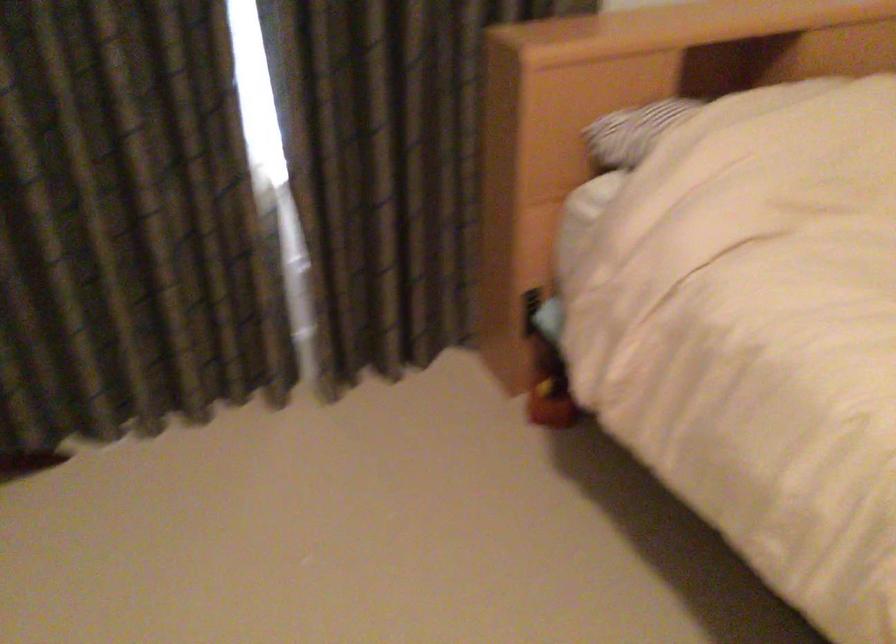
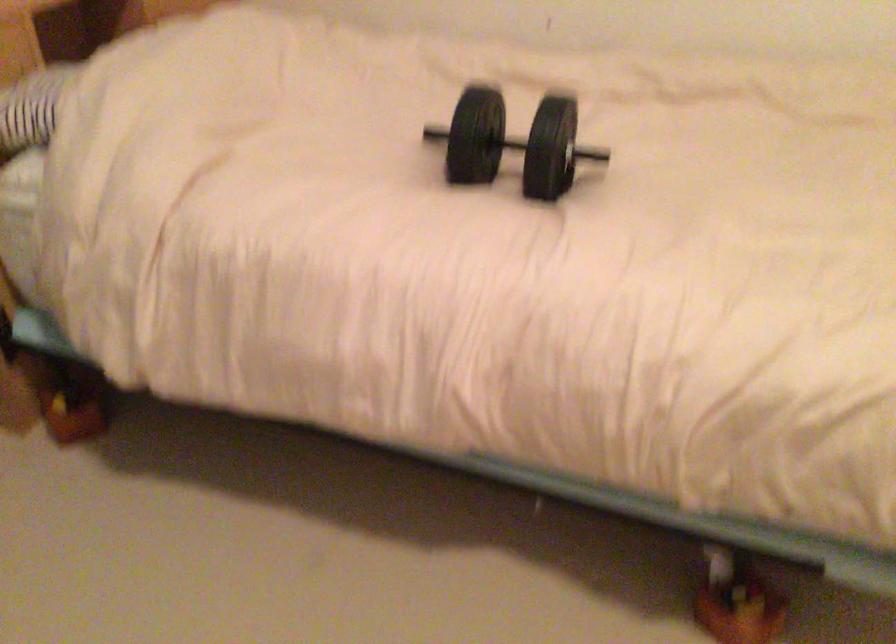
Question: Based on the continuous images, in which direction is the camera rotating? Reply with the corresponding letter.

Choices:
 (A) Left
 (B) Right
 (C) Up
 (D) Down

Answer: (B)